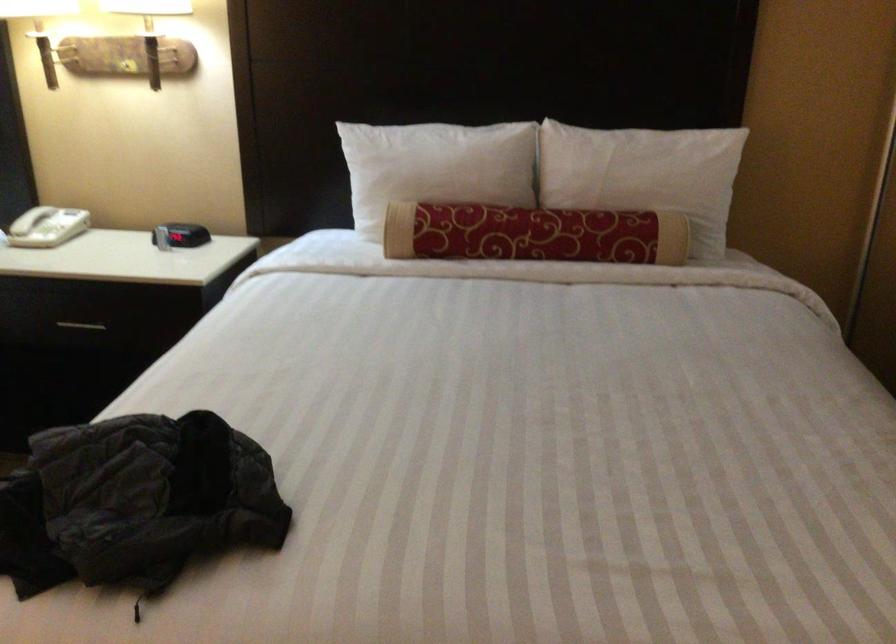
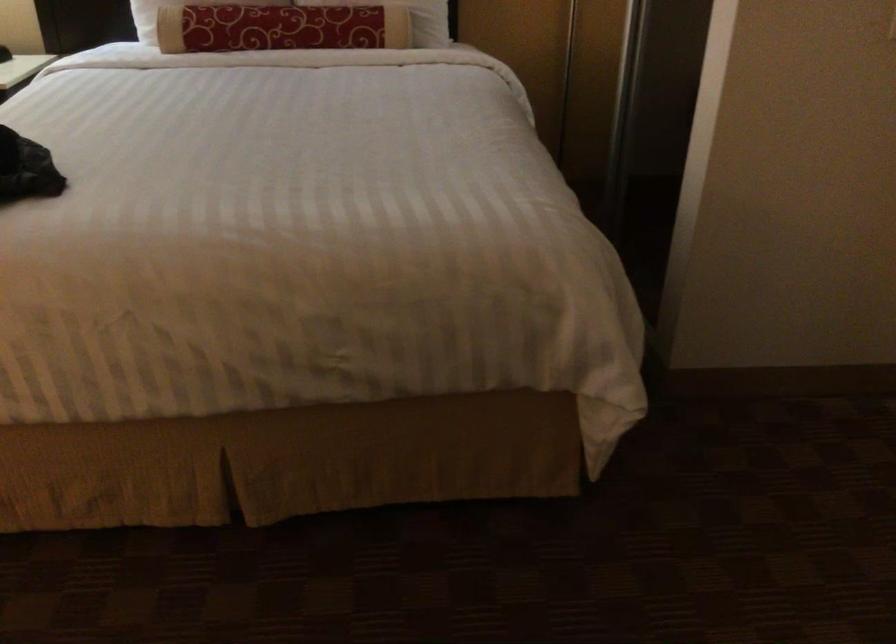
The point at (531, 232) is marked in the first image. Where is the corresponding point in the second image?

(280, 28)